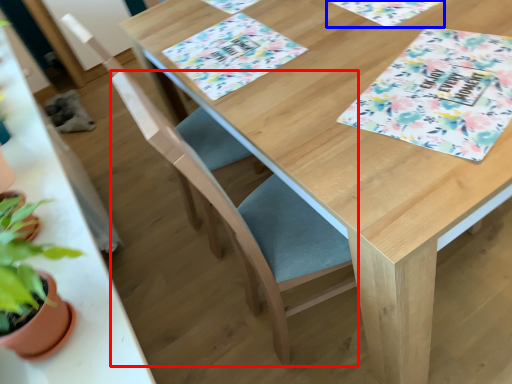
Question: Which point is closer to the camera, folding chair (highlighted by a red box) or place mat (highlighted by a blue box)?

Choices:
 (A) folding chair
 (B) place mat

Answer: (A)